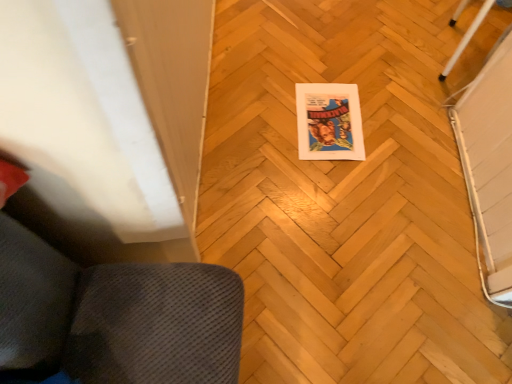
Find the location of `white glossy pole at upper right`. white glossy pole at upper right is located at coordinates (467, 37).

This screenshot has width=512, height=384. I want to click on wooden parquet floor at center, so click(348, 196).

In the image, there is a white glossy pole at upper right. Where is `comic book below it (from the image's perspective)`? comic book below it (from the image's perspective) is located at coordinates (329, 122).

From the image's perspective, who appears lower, white glossy pole at upper right or matte paper comic book at center?

matte paper comic book at center, from the image's perspective.

Can you confirm if white glossy pole at upper right is thinner than matte paper comic book at center?

No.

Considering the positions of points (312, 153) and (502, 327), is point (312, 153) closer to camera compared to point (502, 327)?

No, it is not.

How different are the orientations of matte paper comic book at center and wooden parquet floor at center in degrees?

2.08 degrees.

The image size is (512, 384). In order to click on comic book on the left side of wooden parquet floor at center in this screenshot , I will do `click(329, 122)`.

Considering the sizes of objects matte paper comic book at center and wooden parquet floor at center in the image provided, who is shorter, matte paper comic book at center or wooden parquet floor at center?

matte paper comic book at center is shorter.

Would you say white glossy pole at upper right is inside or outside wooden parquet floor at center?

white glossy pole at upper right is spatially situated outside wooden parquet floor at center.

From the image's perspective, which object appears higher, white glossy pole at upper right or wooden parquet floor at center?

white glossy pole at upper right appears higher in the image.

Is white glossy pole at upper right shorter than wooden parquet floor at center?

No.

Is white glossy pole at upper right closer to camera compared to wooden parquet floor at center?

No, it is behind wooden parquet floor at center.

From the image's perspective, which one is positioned lower, matte paper comic book at center or white glossy pole at upper right?

matte paper comic book at center is shown below in the image.

Which is farther from the camera, (351,110) or (453,14)?

The point (453,14) is more distant.

Which of these two, matte paper comic book at center or white glossy pole at upper right, is bigger?

white glossy pole at upper right.

Who is shorter, wooden parquet floor at center or white glossy pole at upper right?

wooden parquet floor at center is shorter.

Could you tell me if wooden parquet floor at center is facing white glossy pole at upper right?

No, wooden parquet floor at center is not turned towards white glossy pole at upper right.

Is point (321, 68) farther from camera compared to point (469, 32)?

Yes, it is behind point (469, 32).

Is wooden parquet floor at center smaller than white glossy pole at upper right?

Incorrect, wooden parquet floor at center is not smaller in size than white glossy pole at upper right.

Which is correct: wooden parquet floor at center is inside matte paper comic book at center, or outside of it?

wooden parquet floor at center is not enclosed by matte paper comic book at center.

Is point (230, 188) more distant than point (332, 127)?

That is False.

Locate an element on the screen. The height and width of the screenshot is (384, 512). plywood in front of the matte paper comic book at center is located at coordinates (348, 196).

From a real-world perspective, which is physically below, wooden parquet floor at center or matte paper comic book at center?

wooden parquet floor at center.

Locate an element on the screen. This screenshot has width=512, height=384. comic book below the white glossy pole at upper right (from the image's perspective) is located at coordinates (329, 122).

There is a wooden parquet floor at center. Find the location of `comic book above it (from a real-world perspective)`. comic book above it (from a real-world perspective) is located at coordinates (329, 122).

When comparing their distances from white glossy pole at upper right, does matte paper comic book at center or wooden parquet floor at center seem further?

The object further to white glossy pole at upper right is wooden parquet floor at center.

Based on their spatial positions, is white glossy pole at upper right or matte paper comic book at center closer to wooden parquet floor at center?

The object closer to wooden parquet floor at center is matte paper comic book at center.

Consider the image. Which object lies nearer to the anchor point white glossy pole at upper right, wooden parquet floor at center or matte paper comic book at center?

matte paper comic book at center is positioned closer to the anchor white glossy pole at upper right.

Considering their positions, is wooden parquet floor at center positioned closer to matte paper comic book at center than white glossy pole at upper right?

Among the two, wooden parquet floor at center is located nearer to matte paper comic book at center.

Considering their positions, is white glossy pole at upper right positioned further to matte paper comic book at center than wooden parquet floor at center?

white glossy pole at upper right is further to matte paper comic book at center.

Looking at the image, which one is located further to wooden parquet floor at center, matte paper comic book at center or white glossy pole at upper right?

white glossy pole at upper right.

Locate an element on the screen. This screenshot has width=512, height=384. plywood situated between matte paper comic book at center and white glossy pole at upper right from left to right is located at coordinates (348, 196).